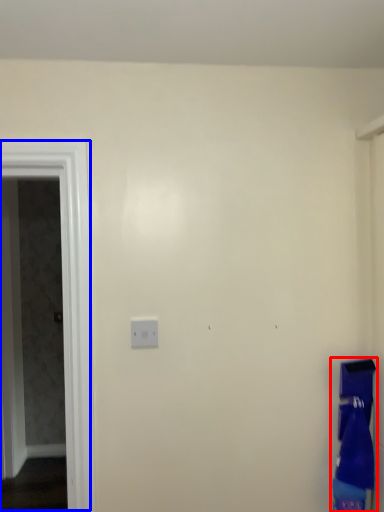
Question: Which object is closer to the camera taking this photo, laundry (highlighted by a red box) or screen door (highlighted by a blue box)?

Choices:
 (A) laundry
 (B) screen door

Answer: (A)